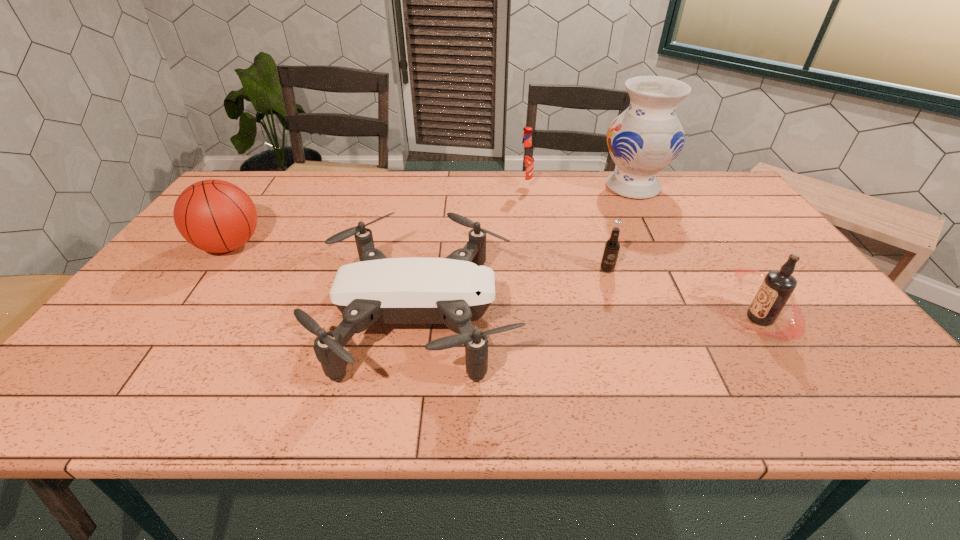
You are a GUI agent. You are given a task and a screenshot of the screen. Output one action in this format:
    pyautogui.click(x=<x>, y=<y>)
    Task: Click on the object that is at the right edge
    This screenshot has height=540, width=960.
    Given the screenshot: What is the action you would take?
    pyautogui.click(x=778, y=285)

In the image, there is a desktop. What are the coordinates of `free space at the far edge` in the screenshot? It's located at (301, 198).

Locate an element on the screen. blank space at the near edge is located at coordinates (288, 393).

Locate an element on the screen. This screenshot has height=540, width=960. free space at the left edge is located at coordinates (210, 261).

Identify the location of vacant region at the right edge of the desktop. (817, 371).

At what (x,y) coordinates should I click in order to perform the action: click on vacant point located between the vase and the farthest root beer. Please return your answer as a coordinate pair (x, y). This screenshot has height=540, width=960. Looking at the image, I should click on (578, 187).

I want to click on blank region between the nearest root beer and the drone, so click(x=590, y=319).

Find the location of a particular element. The image size is (960, 540). vacant space that's between the vase and the leftmost root beer is located at coordinates (578, 187).

This screenshot has width=960, height=540. Find the location of `free space between the rightmost root beer and the vase`. free space between the rightmost root beer and the vase is located at coordinates (696, 252).

This screenshot has height=540, width=960. I want to click on vacant area that lies between the rightmost root beer and the third object from left to right, so click(641, 252).